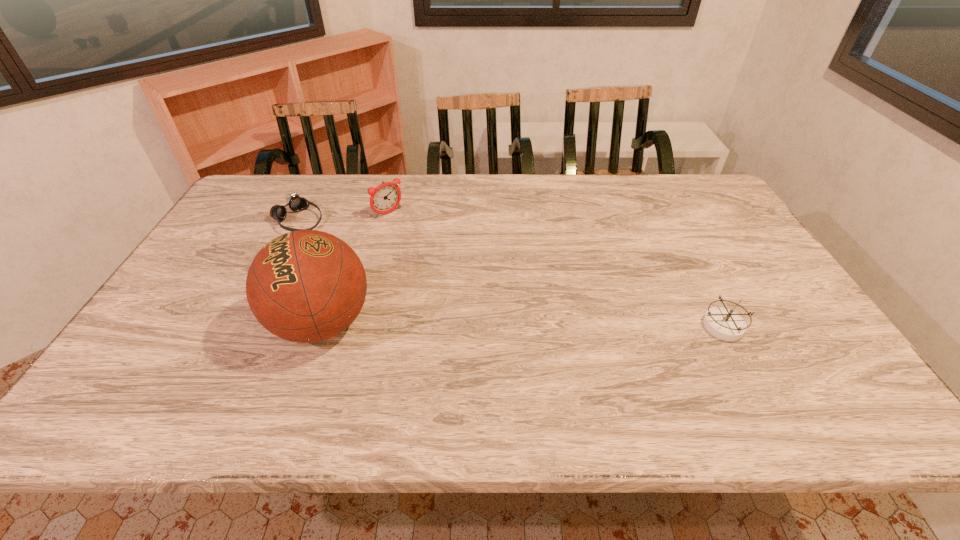
At what (x,y) coordinates should I click in order to perform the action: click on free space that satisfies the following two spatial constraints: 1. on the front side of the rightmost object; 2. on the left side of the goggles. Please return your answer as a coordinate pair (x, y). Looking at the image, I should click on tap(245, 326).

What are the coordinates of `blank space that satisfies the following two spatial constraints: 1. on the back side of the alarm clock; 2. on the right side of the basketball` in the screenshot? It's located at (360, 213).

Where is `free point that satisfies the following two spatial constraints: 1. on the front side of the tallest object; 2. on the right side of the compass`? free point that satisfies the following two spatial constraints: 1. on the front side of the tallest object; 2. on the right side of the compass is located at coordinates (322, 326).